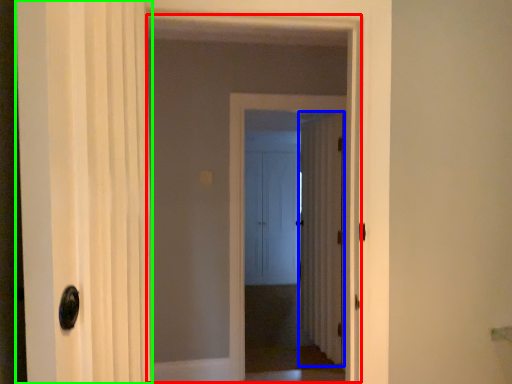
Question: Based on their relative distances, which object is nearer to elevator (highlighted by a red box)? Choose from door (highlighted by a blue box) and door (highlighted by a green box).

Choices:
 (A) door
 (B) door

Answer: (A)